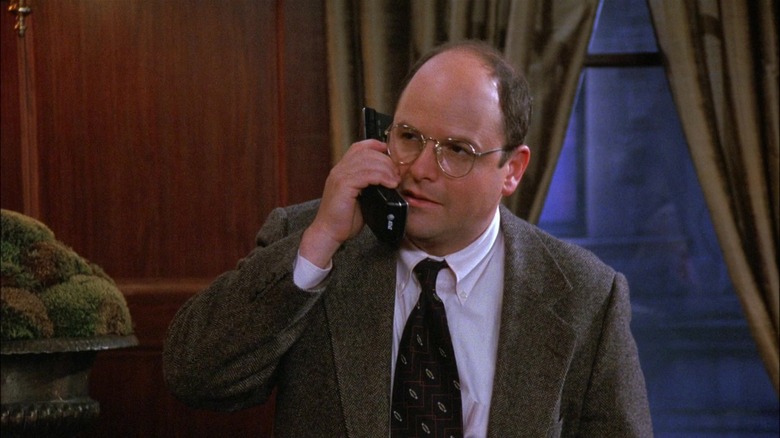
The height and width of the screenshot is (438, 780). I want to click on window, so pyautogui.click(x=642, y=236).